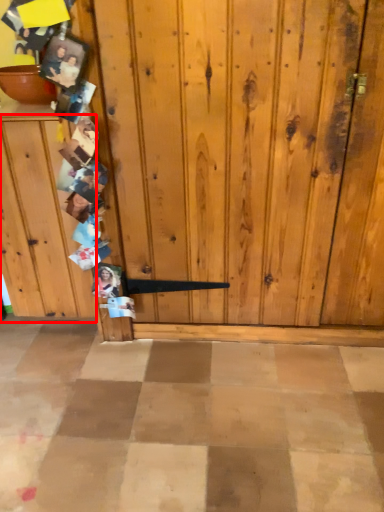
Question: From the image's perspective, what is the correct spatial positioning of dresser (annotated by the red box) in reference to bowl?

Choices:
 (A) below
 (B) above

Answer: (A)